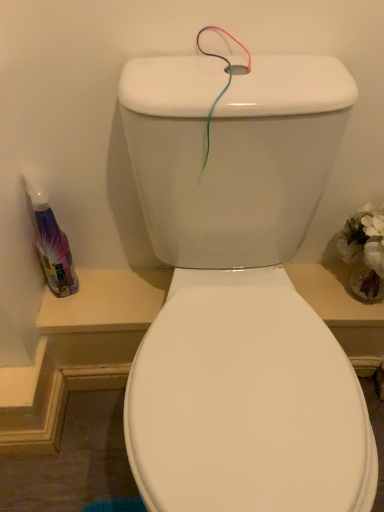
At what (x,y) coordinates should I click in order to perform the action: click on unoccupied region to the right of purple glossy spray bottle at left. Please return your answer as a coordinate pair (x, y). This screenshot has width=384, height=512. Looking at the image, I should click on pyautogui.click(x=111, y=287).